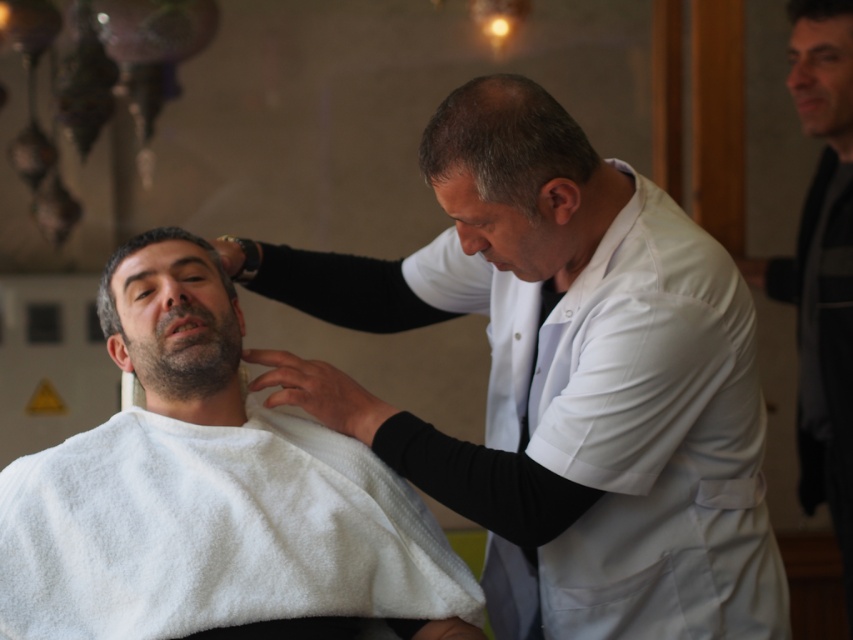
Can you confirm if white matte coat at center is positioned below white cloth at center?

Actually, white matte coat at center is above white cloth at center.

Can you confirm if white matte coat at center is taller than white cloth at center?

Yes, white matte coat at center is taller than white cloth at center.

Who is more distant from viewer, (x=572, y=346) or (x=154, y=244)?

Positioned behind is point (x=154, y=244).

Find the location of a particular element. white matte coat at center is located at coordinates (566, 380).

Is black matte jacket at right shorter than dark brown hair at center?

No.

Is point (819, 358) less distant than point (131, 246)?

That is False.

Who is more forward, [850,484] or [115,256]?

Point [115,256]

Locate an element on the screen. black matte jacket at right is located at coordinates (821, 266).

Is white matte coat at center taller than dark brown hair at center?

Yes, white matte coat at center is taller than dark brown hair at center.

Consider the image. Which of these two, white matte coat at center or dark brown hair at center, stands shorter?

With less height is dark brown hair at center.

The width and height of the screenshot is (853, 640). What are the coordinates of `white matte coat at center` in the screenshot? It's located at (566, 380).

Where is `white matte coat at center`? white matte coat at center is located at coordinates (566, 380).